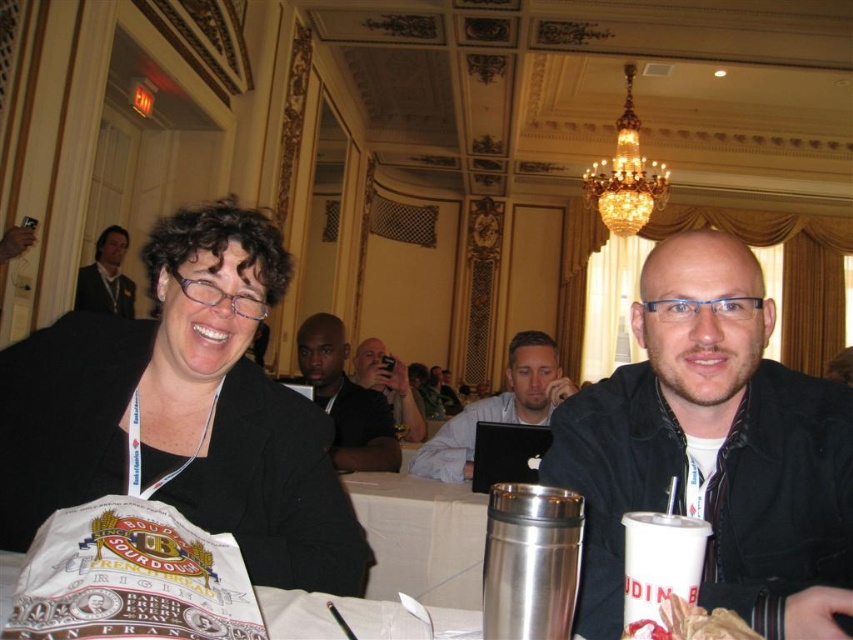
Is matte black laptop at center thinner than golden crispy chicken at lower right?

No.

Which is below, matte black laptop at center or golden crispy chicken at lower right?

matte black laptop at center

Which is in front, point (512, 397) or point (625, 634)?

Point (625, 634) is in front.

Find the location of a particular element. matte black laptop at center is located at coordinates (497, 408).

Which of these two, silver metallic cup at center or dark skin bald man at center, stands shorter?

silver metallic cup at center

Is silver metallic cup at center closer to camera compared to dark skin bald man at center?

Yes, silver metallic cup at center is closer to the viewer.

Measure the distance between silver metallic cup at center and camera.

8.10 feet

You are a GUI agent. You are given a task and a screenshot of the screen. Output one action in this format:
    pyautogui.click(x=<x>, y=<y>)
    Task: Click on the silver metallic cup at center
    This screenshot has height=640, width=853.
    Given the screenshot: What is the action you would take?
    pyautogui.click(x=421, y=538)

Is black matte jacket at right below golden crispy chicken at lower right?

No.

Between black matte jacket at right and golden crispy chicken at lower right, which one has less height?

Standing shorter between the two is golden crispy chicken at lower right.

Is point (607, 451) farther from viewer compared to point (640, 630)?

Yes, it is.

Where is `black matte jacket at right`? The image size is (853, 640). black matte jacket at right is located at coordinates (714, 451).